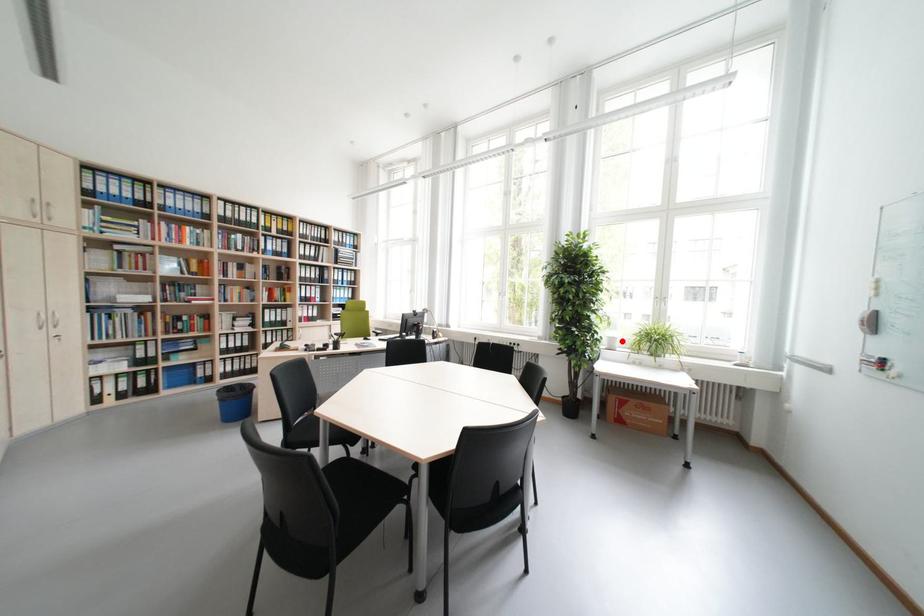
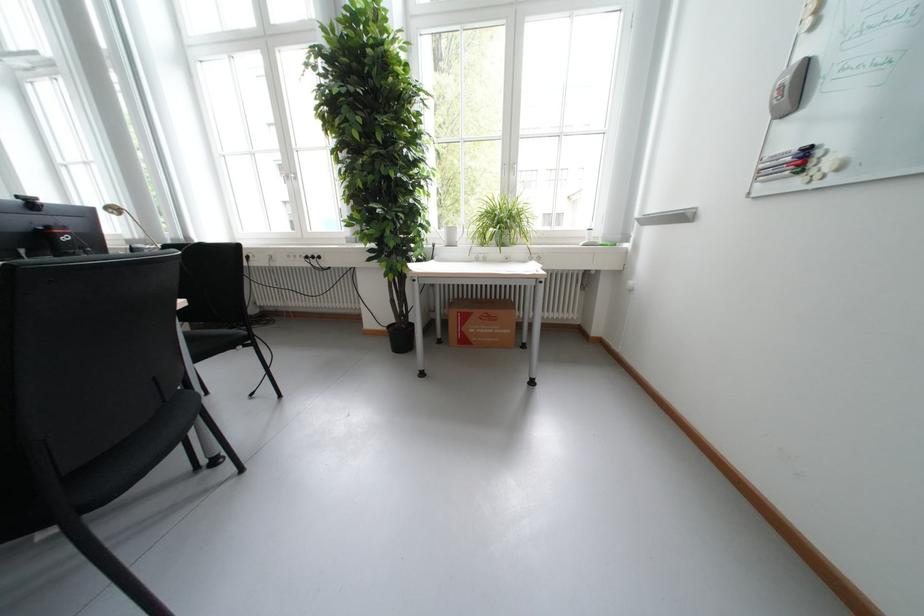
Locate, in the second image, the point that corresponds to the highlighted location in the first image.

(460, 233)